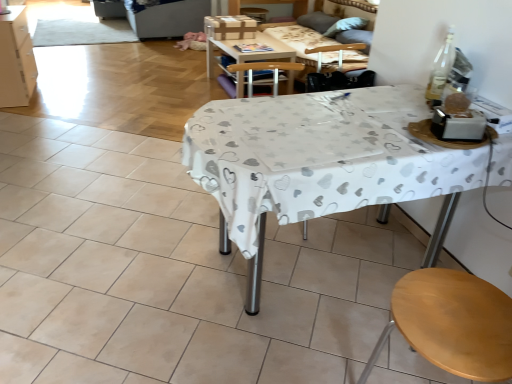
The height and width of the screenshot is (384, 512). I want to click on vacant point to the right of white matte cabinet at left, so click(66, 96).